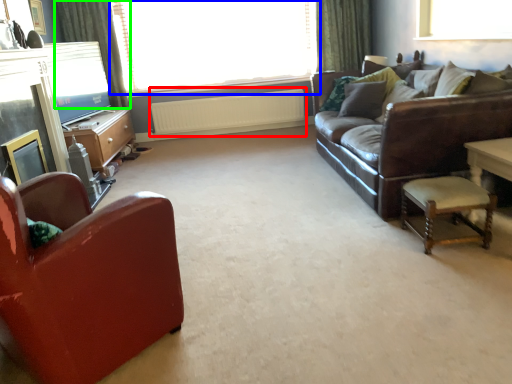
Question: Based on their relative distances, which object is nearer to radiator (highlighted by a red box)? Choose from window (highlighted by a blue box) and curtain (highlighted by a green box).

Choices:
 (A) window
 (B) curtain

Answer: (A)